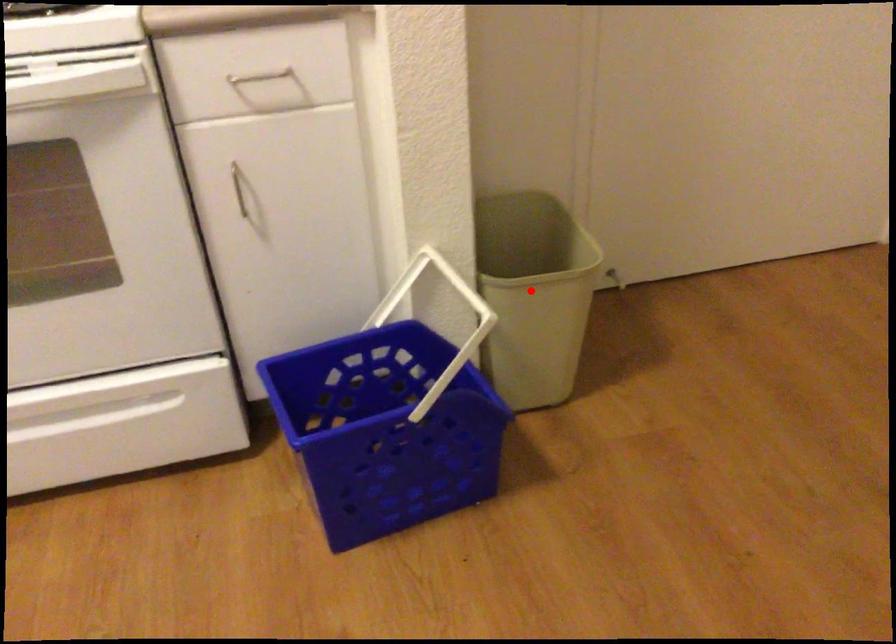
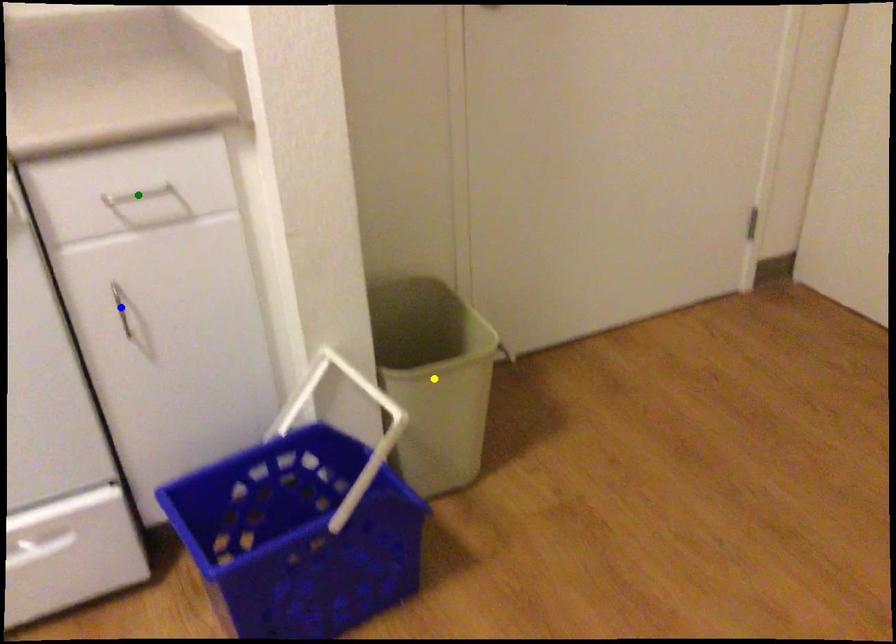
Question: I am providing you with two images of the same scene from different viewpoints. A red point is marked on the first image. You are given multiple points on the second image. In image 2, which mark is for the same physical point as the one in image 1?

Choices:
 (A) yellow point
 (B) blue point
 (C) green point

Answer: (A)